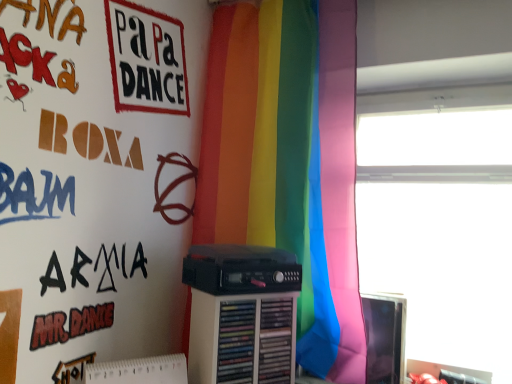
Question: Is rainbow fabric curtain at center outside of matte black monitor at right?

Choices:
 (A) yes
 (B) no

Answer: (A)

Question: Can you confirm if rainbow fabric curtain at center is wider than matte black monitor at right?

Choices:
 (A) no
 (B) yes

Answer: (B)

Question: Is rainbow fabric curtain at center at the left side of matte black monitor at right?

Choices:
 (A) yes
 (B) no

Answer: (A)

Question: Does rainbow fabric curtain at center have a smaller size compared to matte black monitor at right?

Choices:
 (A) no
 (B) yes

Answer: (A)

Question: Is rainbow fabric curtain at center behind matte black monitor at right?

Choices:
 (A) yes
 (B) no

Answer: (B)

Question: Does rainbow fabric curtain at center come in front of matte black monitor at right?

Choices:
 (A) yes
 (B) no

Answer: (A)

Question: From a real-world perspective, does black plastic cassette at center sit lower than transparent glass window at upper right?

Choices:
 (A) yes
 (B) no

Answer: (A)

Question: Is black plastic cassette at center positioned behind transparent glass window at upper right?

Choices:
 (A) no
 (B) yes

Answer: (A)

Question: Is the surface of black plastic cassette at center in direct contact with transparent glass window at upper right?

Choices:
 (A) no
 (B) yes

Answer: (A)

Question: Could transparent glass window at upper right be considered to be inside black plastic cassette at center?

Choices:
 (A) yes
 (B) no

Answer: (B)

Question: From the image's perspective, is black plastic cassette at center located beneath transparent glass window at upper right?

Choices:
 (A) yes
 (B) no

Answer: (A)

Question: Is black plastic cassette at center aimed at transparent glass window at upper right?

Choices:
 (A) yes
 (B) no

Answer: (B)

Question: Considering the relative positions of matte black monitor at right and transparent glass window at upper right in the image provided, is matte black monitor at right to the left of transparent glass window at upper right from the viewer's perspective?

Choices:
 (A) yes
 (B) no

Answer: (A)